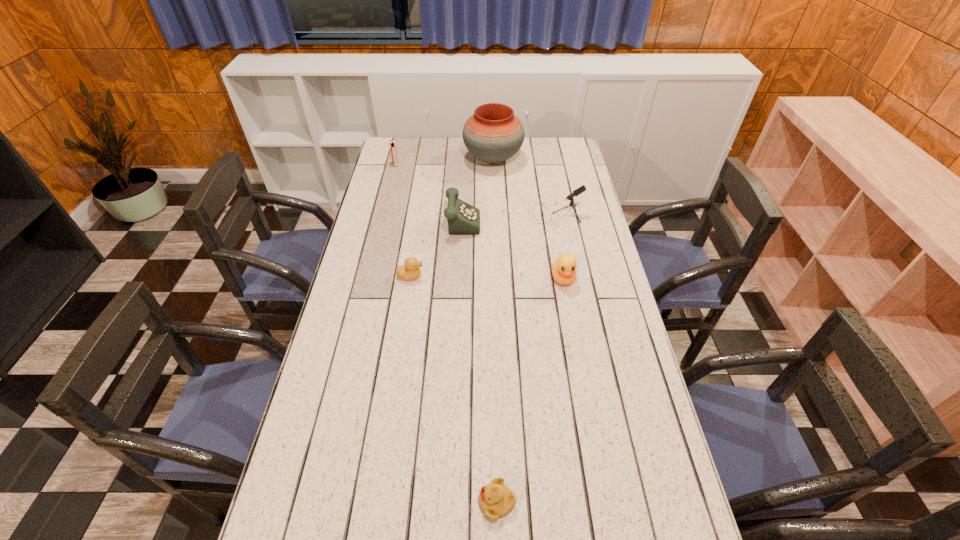
Where is `free space between the leftmost object and the second tallest duckling`? The height and width of the screenshot is (540, 960). free space between the leftmost object and the second tallest duckling is located at coordinates (403, 220).

I want to click on empty location between the telephone and the shortest duckling, so click(477, 360).

You are a GUI agent. You are given a task and a screenshot of the screen. Output one action in this format:
    pyautogui.click(x=<x>, y=<y>)
    Task: Click on the vacant area between the pottery and the igniter
    The height and width of the screenshot is (540, 960).
    Given the screenshot: What is the action you would take?
    pyautogui.click(x=444, y=161)

You are a GUI agent. You are given a task and a screenshot of the screen. Output one action in this format:
    pyautogui.click(x=<x>, y=<y>)
    Task: Click on the free space between the rightmost duckling and the nearest duckling
    This screenshot has height=540, width=960.
    Given the screenshot: What is the action you would take?
    pyautogui.click(x=530, y=390)

Identify the location of free point between the shortest duckling and the rightmost duckling. (530, 390).

Identify the location of empty space that is in between the microphone and the shortest duckling. (526, 357).

You are a GUI agent. You are given a task and a screenshot of the screen. Output one action in this format:
    pyautogui.click(x=<x>, y=<y>)
    Task: Click on the free point between the second duckling from left to right and the telephone
    This screenshot has width=960, height=540.
    Given the screenshot: What is the action you would take?
    pyautogui.click(x=477, y=360)

The width and height of the screenshot is (960, 540). Identify the location of object that is the second closest to the microphone. pyautogui.click(x=493, y=134).

In order to click on object that stands as the second closest to the shortest object in this screenshot , I will do `click(410, 270)`.

This screenshot has height=540, width=960. I want to click on duckling that is the closest one to the telephone, so click(410, 270).